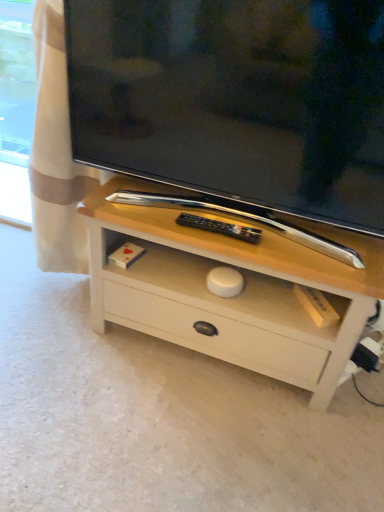
Find the location of a particular element. vacant space in front of white painted wood chest of drawers at center is located at coordinates (196, 439).